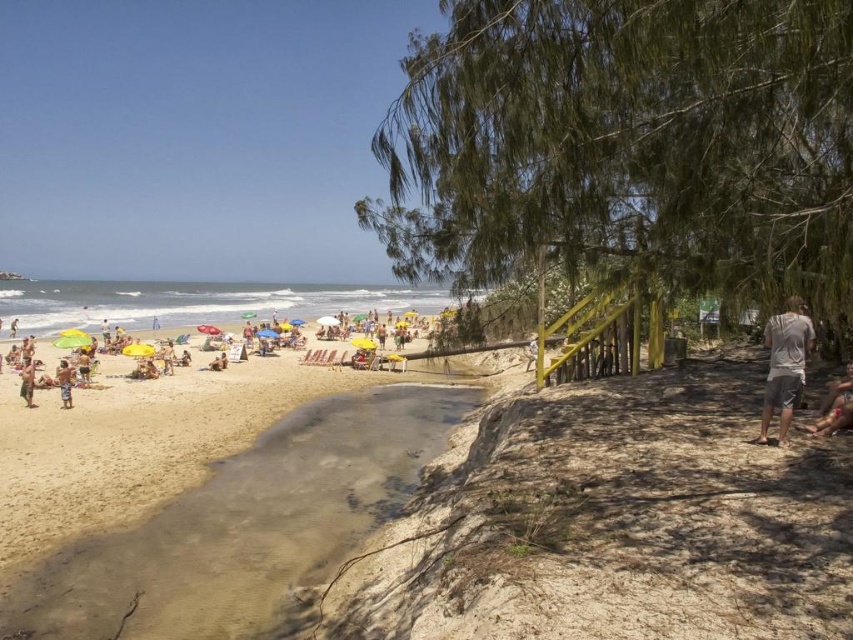
Is gray cotton shirt at right bigger than brown fabric shorts at lower left?

Actually, gray cotton shirt at right might be smaller than brown fabric shorts at lower left.

Is point (785, 392) less distant than point (22, 376)?

Yes, it is in front of point (22, 376).

At what (x,y) coordinates should I click in order to perform the action: click on gray cotton shirt at right. Please return your answer as a coordinate pair (x, y). Looking at the image, I should click on (784, 365).

Is light brown sand at lower left in front of beige textured shorts at lower left?

Yes.

Is light brown sand at lower left smaller than beige textured shorts at lower left?

Incorrect, light brown sand at lower left is not smaller in size than beige textured shorts at lower left.

This screenshot has height=640, width=853. What do you see at coordinates (244, 528) in the screenshot?
I see `light brown sand at lower left` at bounding box center [244, 528].

The image size is (853, 640). Find the location of `light brown sand at lower left`. light brown sand at lower left is located at coordinates (244, 528).

Is gray cotton shirt at right smaller than beige textured shorts at lower left?

Incorrect, gray cotton shirt at right is not smaller in size than beige textured shorts at lower left.

Find the location of a particular element. This screenshot has height=640, width=853. gray cotton shirt at right is located at coordinates (784, 365).

Identify the location of gray cotton shirt at right. (784, 365).